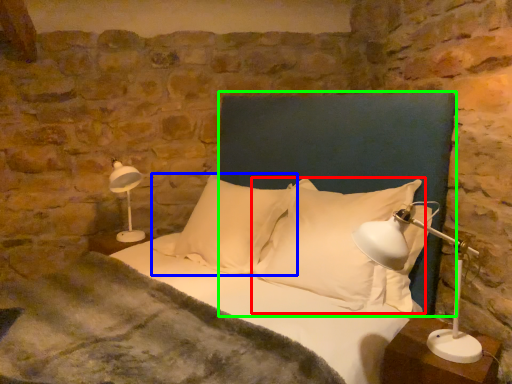
Question: Estimate the real-world distances between objects in this image. Which object is closer to pillow (highlighted by a red box), pillow (highlighted by a blue box) or headboard (highlighted by a green box)?

Choices:
 (A) pillow
 (B) headboard

Answer: (A)